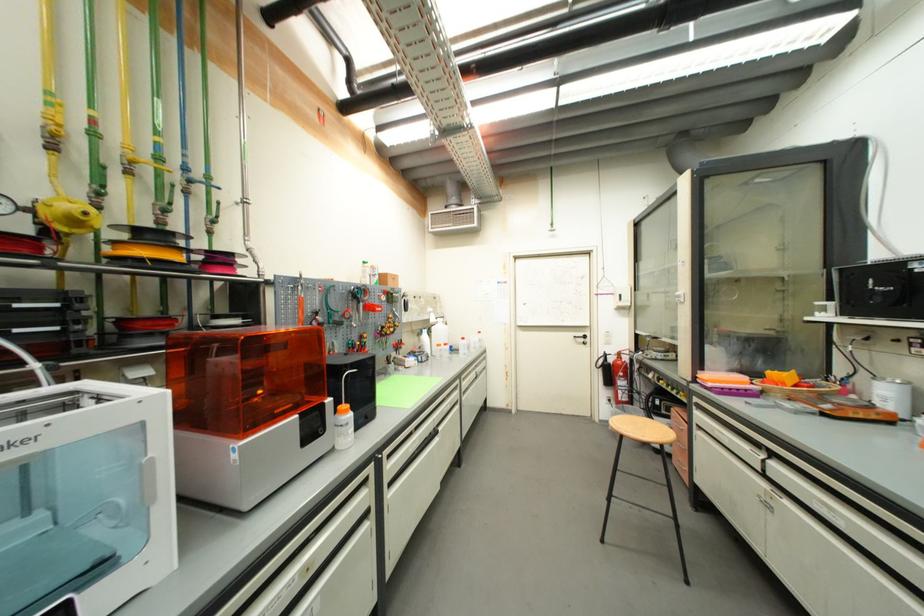
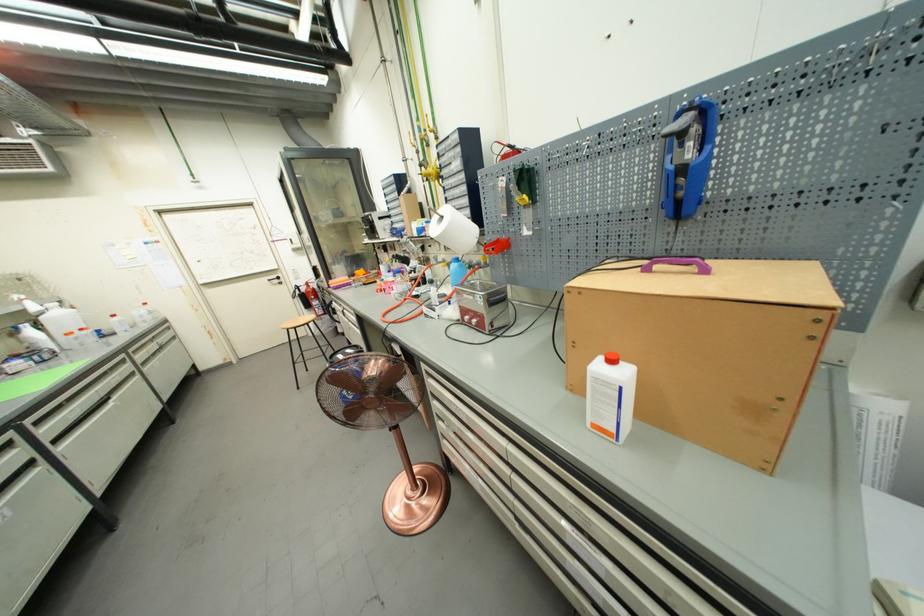
Where in the second image is the point corresponding to point (392, 483) from the first image?

(52, 440)